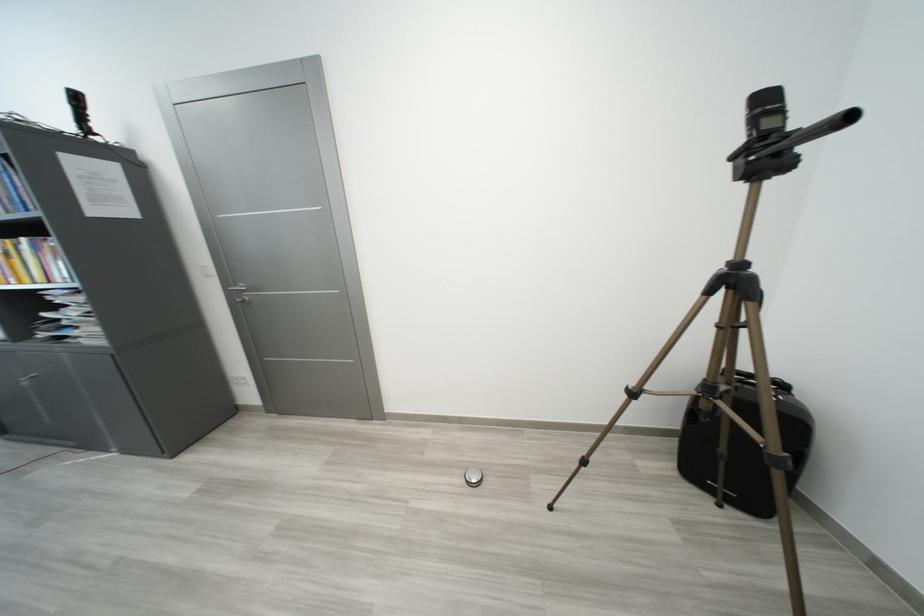
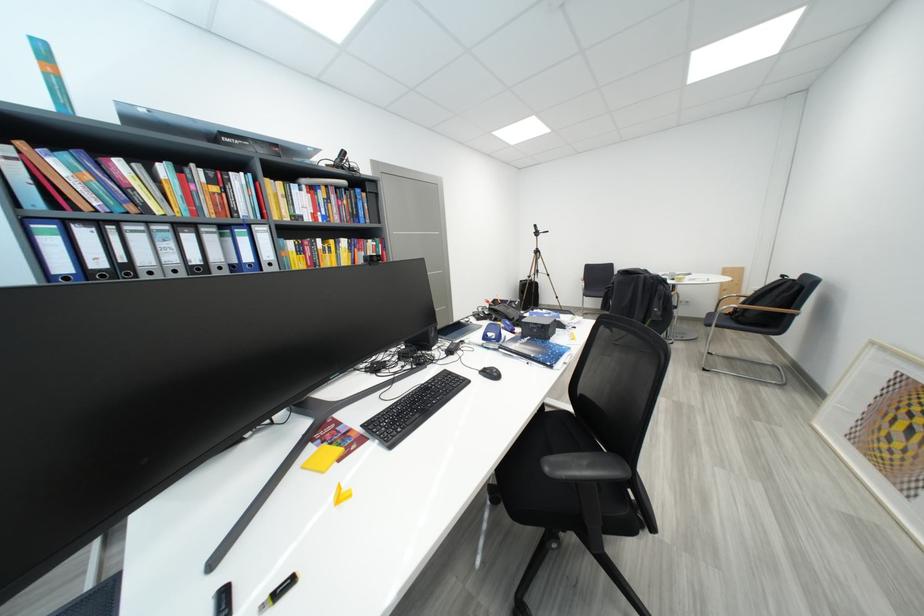
Question: I am providing you with two images of the same scene from different viewpoints. After the viewpoint changes to image2, which objects are now occluded?

Choices:
 (A) colorful book
 (B) black case handle
 (C) backpack top handle
 (D) cylindrical toy container

Answer: (B)